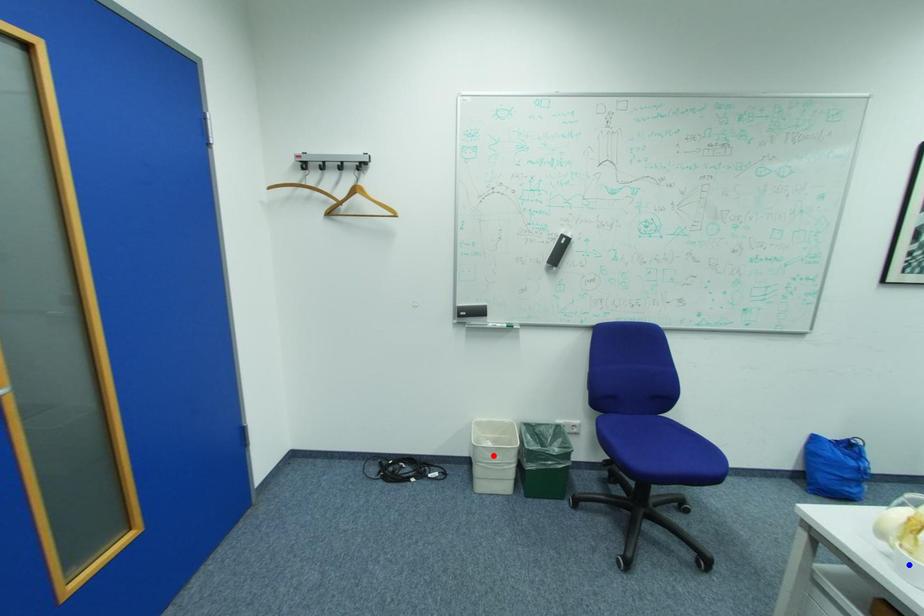
Question: In the image, two points are highlighted. Which point is nearer to the camera? Reply with the corresponding letter.

Choices:
 (A) blue point
 (B) red point

Answer: (A)